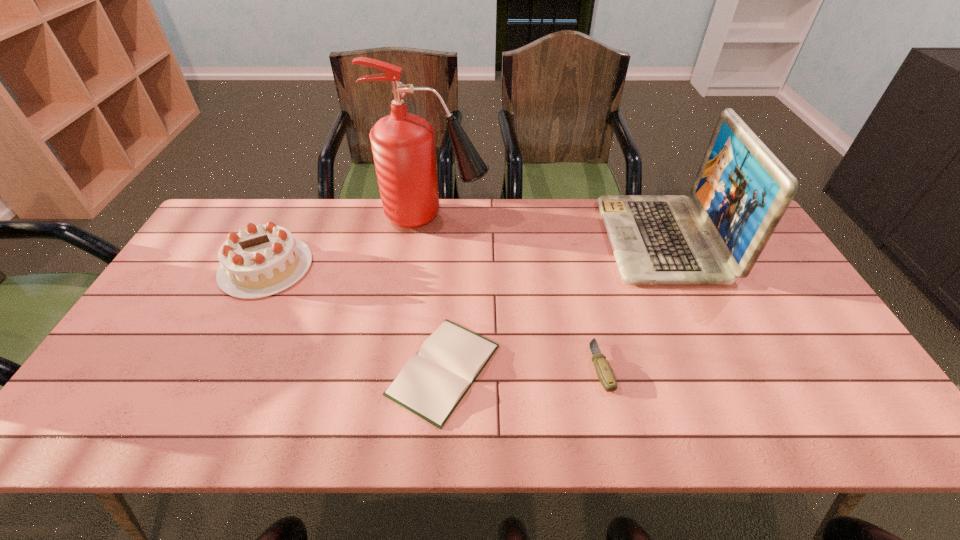
At what (x,y) coordinates should I click in order to perform the action: click on object located at the right edge. Please return your answer as a coordinate pair (x, y). Looking at the image, I should click on (742, 190).

The height and width of the screenshot is (540, 960). I want to click on object located at the far left corner, so click(263, 260).

This screenshot has width=960, height=540. I want to click on object present at the far right corner, so click(x=742, y=190).

Image resolution: width=960 pixels, height=540 pixels. I want to click on vacant space at the far edge of the desktop, so [333, 229].

Locate an element on the screen. This screenshot has width=960, height=540. vacant space at the near edge of the desktop is located at coordinates (474, 422).

You are a GUI agent. You are given a task and a screenshot of the screen. Output one action in this format:
    pyautogui.click(x=<x>, y=<y>)
    Task: Click on the free region at the left edge of the desktop
    The image size is (960, 540).
    Given the screenshot: What is the action you would take?
    pyautogui.click(x=204, y=254)

This screenshot has width=960, height=540. What are the coordinates of `free space at the right edge of the desktop` in the screenshot? It's located at (748, 293).

Image resolution: width=960 pixels, height=540 pixels. In order to click on empty space between the tallest object and the rightmost object in this screenshot , I will do `click(548, 228)`.

This screenshot has height=540, width=960. In order to click on empty space between the second object from right to left and the tallest object in this screenshot , I will do `click(517, 291)`.

Find the location of a particular element. The height and width of the screenshot is (540, 960). free space between the birthday cake and the fire extinguisher is located at coordinates (350, 242).